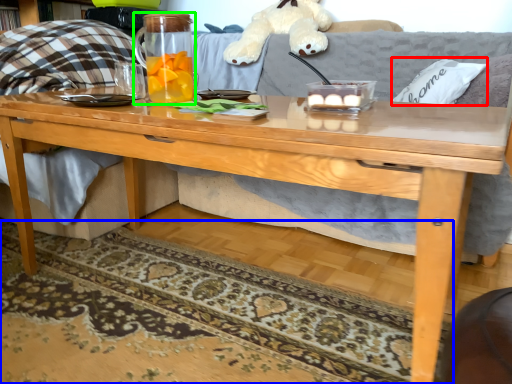
Question: Considering the real-world distances, which object is farthest from pillow (highlighted by a red box)? mat (highlighted by a blue box) or beverage (highlighted by a green box)?

Choices:
 (A) mat
 (B) beverage

Answer: (A)